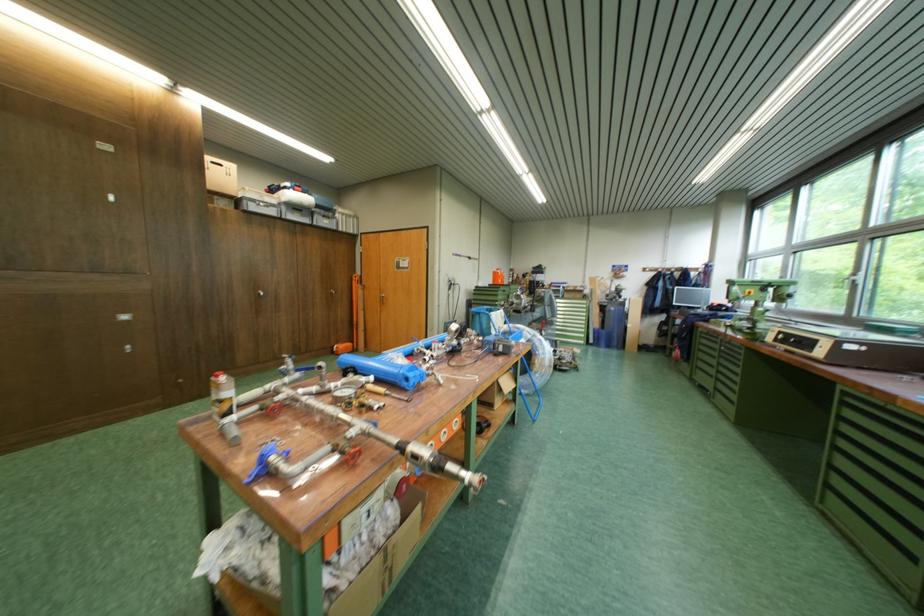
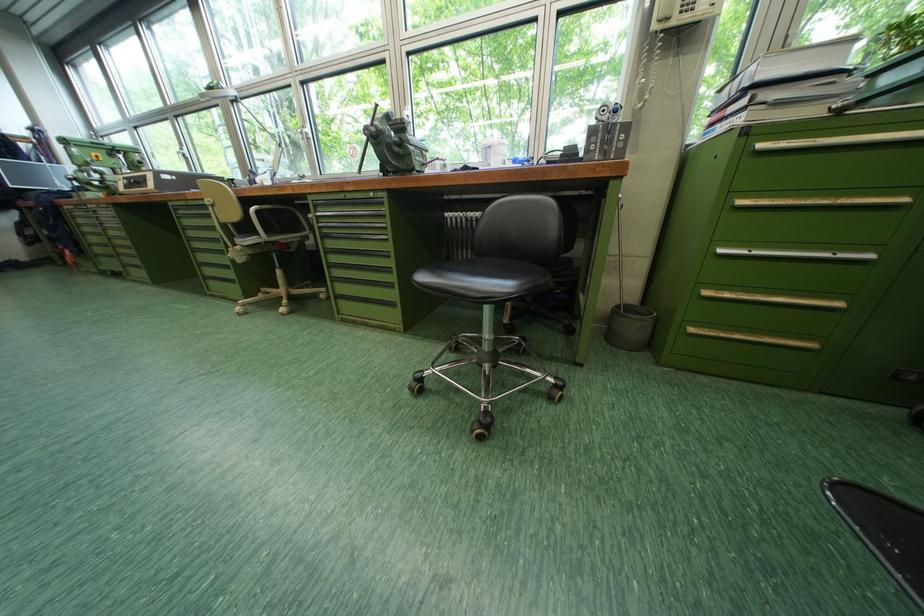
The images are taken continuously from a first-person perspective. In which direction is your viewpoint rotating?

The rotation direction of the camera is right-down.